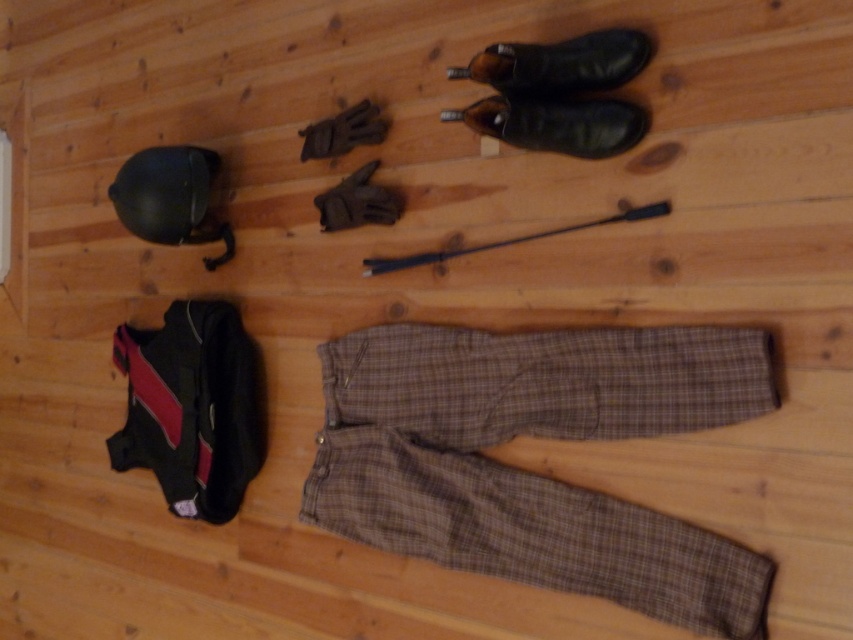
You are organizing the equestrian gear on the wooden floor. You need to place a 12 inch long ruler between the brown plaid pants at center and the leather shoe at upper center. Will the ruler fit between them?

The distance between the brown plaid pants at center and the leather shoe at upper center is 20.75 inches, so yes, the 12 inch ruler will fit between them since it is shorter than the available space.